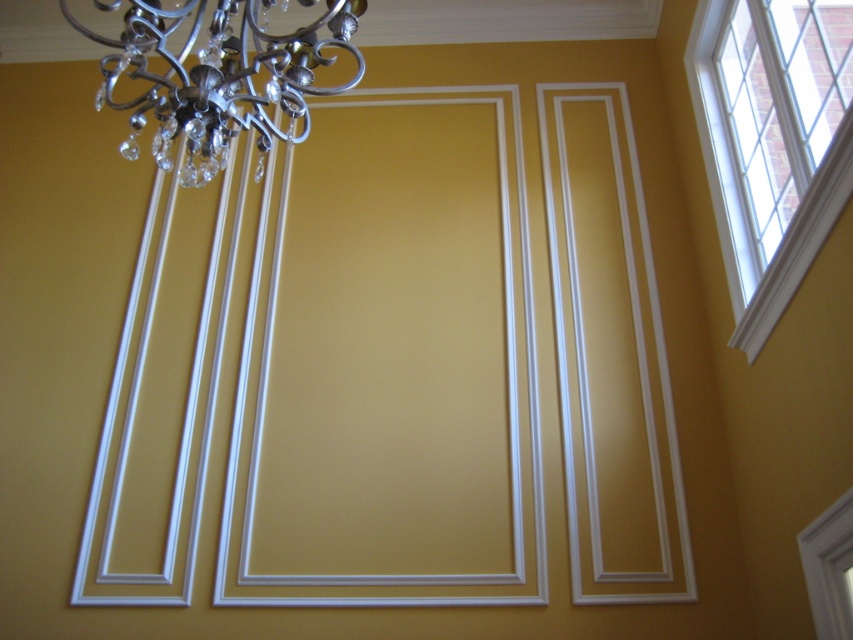
You are standing in the room and want to look outside through the white glass window at upper right. Where should you look relative to the chandelier in the upper left corner?

You should look to the right of the chandelier in the upper left corner to find the white glass window at upper right.

You are standing in the room and want to clean both the white glass window at upper right and the metallic silver chandelier at upper left. Which object should you clean first if you want to start with the one closer to you?

You should clean the white glass window at upper right first because it is closer to you than the metallic silver chandelier at upper left.